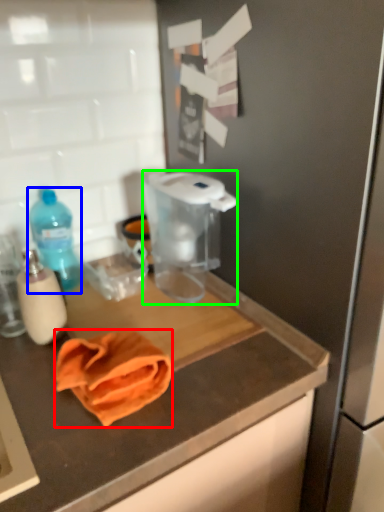
Question: Which is farther away from towel/napkin (highlighted by a red box)? bottle (highlighted by a blue box) or appliance (highlighted by a green box)?

Choices:
 (A) bottle
 (B) appliance

Answer: (A)